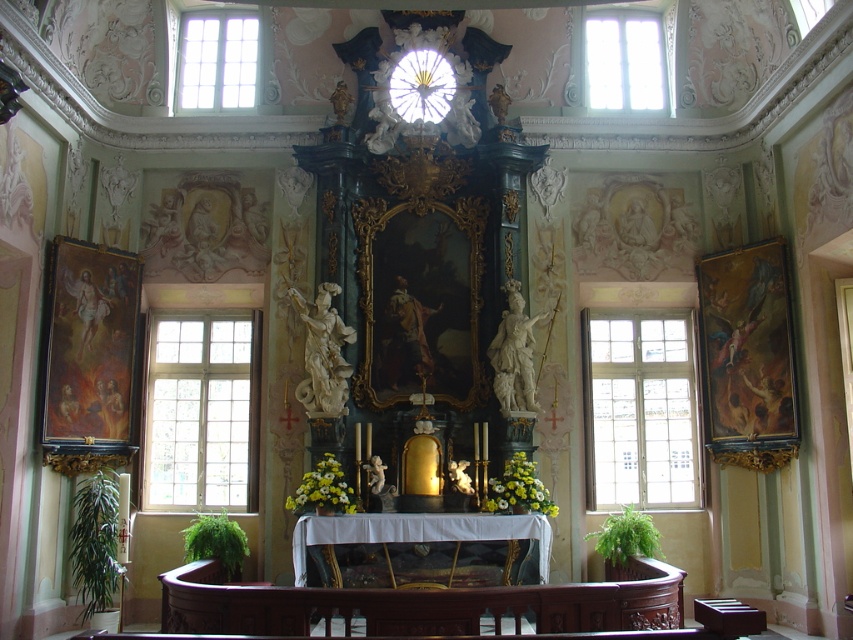
Between clear glass window at left and clear glass window at upper right, which one appears on the right side from the viewer's perspective?

Positioned to the right is clear glass window at upper right.

Can you confirm if clear glass window at left is wider than clear glass window at upper right?

Indeed, clear glass window at left has a greater width compared to clear glass window at upper right.

Find the location of `clear glass window at left`. clear glass window at left is located at coordinates (202, 412).

Can you confirm if clear glass window at right is positioned below clear glass window at upper center?

Correct, clear glass window at right is located below clear glass window at upper center.

Can you confirm if clear glass window at right is positioned to the left of clear glass window at upper center?

No, clear glass window at right is not to the left of clear glass window at upper center.

At what (x,y) coordinates should I click in order to perform the action: click on clear glass window at right. Please return your answer as a coordinate pair (x, y). Image resolution: width=853 pixels, height=640 pixels. Looking at the image, I should click on (637, 410).

Measure the distance between clear glass window at left and clear glass window at upper center.

They are 16.05 meters apart.

Which is in front, point (173, 472) or point (218, 33)?

Positioned in front is point (173, 472).

Locate an element on the screen. clear glass window at left is located at coordinates (202, 412).